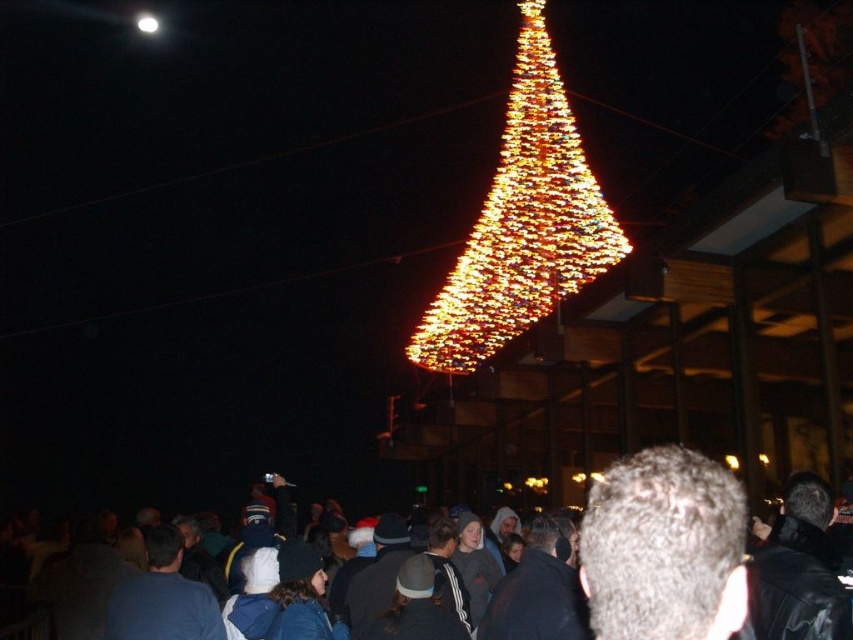
You are standing in a crowd watching a Christmas tree. You notice someone with gray hair at center. Can you reach them within 10 seconds if you start walking towards them at a normal pace?

The distance between you and the gray hair at center is 63.66 meters. At a normal walking speed of about 1.4 meters per second, it would take approximately 45.5 seconds to reach them, so no, you cannot reach them within 10 seconds.